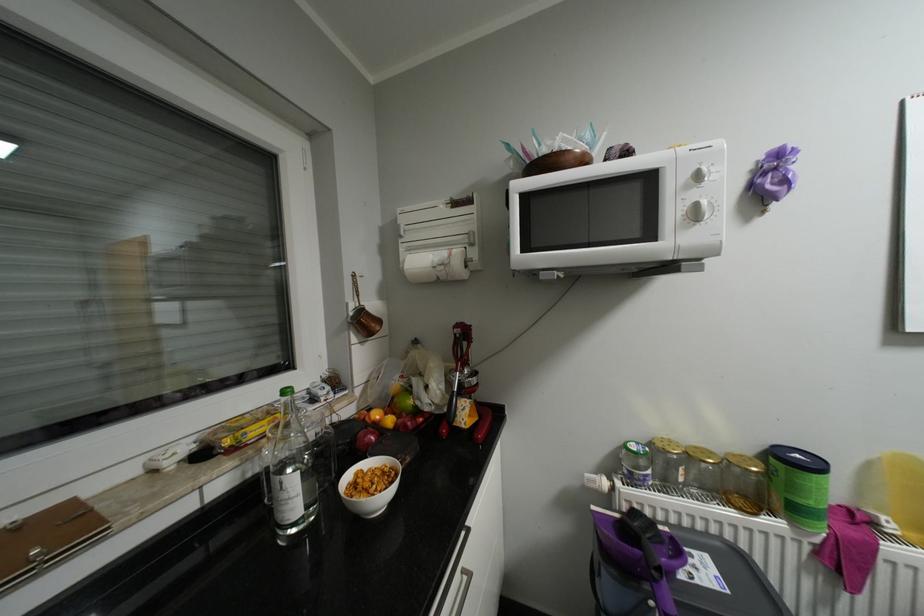
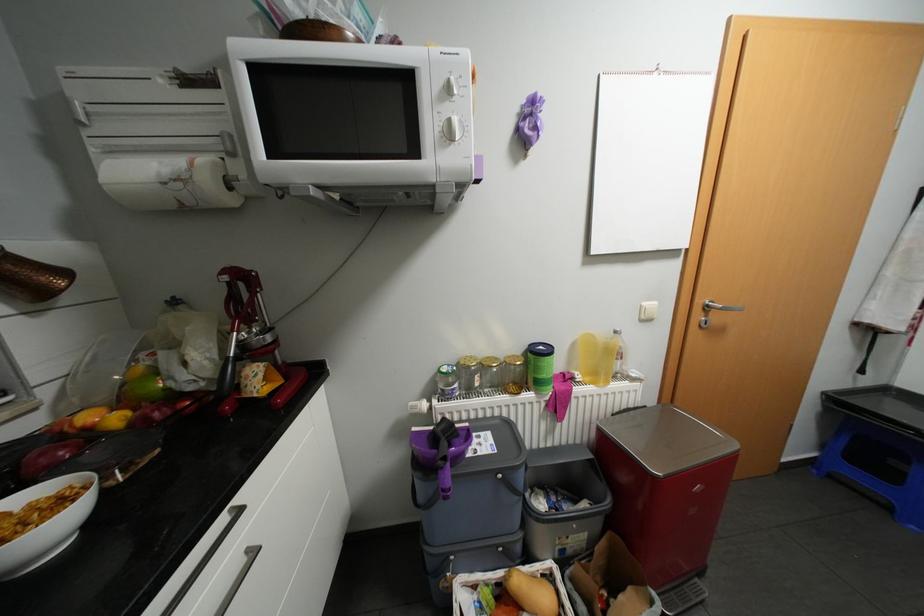
The point at (641, 447) is marked in the first image. Where is the corresponding point in the second image?

(452, 369)